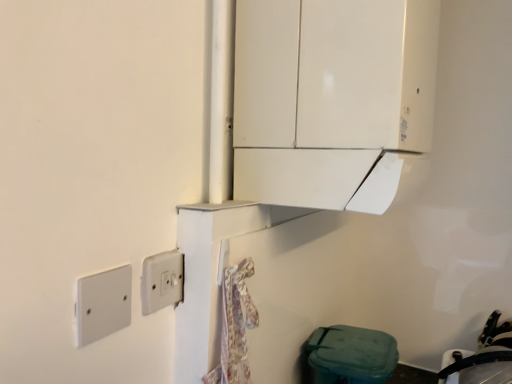
Measure the distance between point [253,64] and camera.

Point [253,64] is 29.57 inches away from camera.

This screenshot has width=512, height=384. What do you see at coordinates (162, 281) in the screenshot?
I see `white plastic light switch at center, the first light switch in the right-to-left sequence` at bounding box center [162, 281].

Find the location of a particular element. The height and width of the screenshot is (384, 512). white glossy cabinet at upper center is located at coordinates (331, 98).

In terms of height, does black rubber sink at lower right look taller or shorter compared to white plastic light switch at center, which is the 2th light switch from front to back?

Considering their sizes, black rubber sink at lower right has more height than white plastic light switch at center, which is the 2th light switch from front to back.

Is black rubber sink at lower right facing towards white plastic light switch at center, which ranks as the first light switch in back-to-front order?

No, black rubber sink at lower right does not turn towards white plastic light switch at center, which ranks as the first light switch in back-to-front order.

What's the angular difference between black rubber sink at lower right and white plastic light switch at center, which ranks as the first light switch in back-to-front order,'s facing directions?

90 degrees.

Is black rubber sink at lower right in front of white plastic light switch at center, which is the 2th light switch from front to back?

No, black rubber sink at lower right is further to the viewer.

Based on the photo, considering the positions of objects white plastic light switch at center, the first light switch in the right-to-left sequence, and white glossy cabinet at upper center in the image provided, who is more to the right, white plastic light switch at center, the first light switch in the right-to-left sequence, or white glossy cabinet at upper center?

white glossy cabinet at upper center is more to the right.

Is white plastic light switch at center, the first light switch in the right-to-left sequence, facing away from white glossy cabinet at upper center?

No, white plastic light switch at center, the first light switch in the right-to-left sequence, is not facing away from white glossy cabinet at upper center.

Identify the location of cabinetry on the right of white plastic light switch at center, the first light switch in the right-to-left sequence. (331, 98).

Is white plastic light switch at center, which ranks as the first light switch in back-to-front order, touching white glossy cabinet at upper center?

No, white plastic light switch at center, which ranks as the first light switch in back-to-front order, is not in contact with white glossy cabinet at upper center.

Could you measure the distance between white plastic light switch at center, the first light switch in the right-to-left sequence, and white plastic/light switch at lower left, positioned as the second light switch in back-to-front order?

white plastic light switch at center, the first light switch in the right-to-left sequence, is 2.85 inches away from white plastic/light switch at lower left, positioned as the second light switch in back-to-front order.

Considering the positions of objects white plastic light switch at center, which ranks as the first light switch in back-to-front order, and white plastic/light switch at lower left, which ranks as the 1th light switch in front-to-back order, in the image provided, who is behind, white plastic light switch at center, which ranks as the first light switch in back-to-front order, or white plastic/light switch at lower left, which ranks as the 1th light switch in front-to-back order,?

white plastic light switch at center, which ranks as the first light switch in back-to-front order, is further away from the camera.

From the picture: Would you say white plastic light switch at center, the first light switch in the right-to-left sequence, is inside or outside white plastic/light switch at lower left, which ranks as the 1th light switch in front-to-back order?

white plastic light switch at center, the first light switch in the right-to-left sequence, is not enclosed by white plastic/light switch at lower left, which ranks as the 1th light switch in front-to-back order.

Can you confirm if white plastic light switch at center, the first light switch in the right-to-left sequence, is positioned to the left of black rubber sink at lower right?

Indeed, white plastic light switch at center, the first light switch in the right-to-left sequence, is positioned on the left side of black rubber sink at lower right.

Considering the sizes of objects white plastic light switch at center, the first light switch in the right-to-left sequence, and black rubber sink at lower right in the image provided, who is bigger, white plastic light switch at center, the first light switch in the right-to-left sequence, or black rubber sink at lower right?

Bigger between the two is black rubber sink at lower right.

From the image's perspective, which one is positioned higher, white plastic light switch at center, which ranks as the first light switch in back-to-front order, or black rubber sink at lower right?

From the image's view, white plastic light switch at center, which ranks as the first light switch in back-to-front order, is above.

Would you say white plastic light switch at center, which is the 2th light switch from front to back, is inside or outside black rubber sink at lower right?

white plastic light switch at center, which is the 2th light switch from front to back, cannot be found inside black rubber sink at lower right.

From a real-world perspective, is black rubber sink at lower right positioned above or below white glossy cabinet at upper center?

From a real-world perspective, black rubber sink at lower right is physically below white glossy cabinet at upper center.

From the image's perspective, does black rubber sink at lower right appear lower than white glossy cabinet at upper center?

Yes, from the image's perspective, black rubber sink at lower right is beneath white glossy cabinet at upper center.

Does black rubber sink at lower right have a lesser width compared to white glossy cabinet at upper center?

Correct, the width of black rubber sink at lower right is less than that of white glossy cabinet at upper center.

Could you tell me if black rubber sink at lower right is turned towards white glossy cabinet at upper center?

No, black rubber sink at lower right is not aimed at white glossy cabinet at upper center.

Between point (345, 104) and point (118, 314), which one is positioned in front?

Point (118, 314)

Looking at this image, in terms of size, does white glossy cabinet at upper center appear bigger or smaller than white plastic/light switch at lower left, the first light switch viewed from the left?

In the image, white glossy cabinet at upper center appears to be larger than white plastic/light switch at lower left, the first light switch viewed from the left.

How distant is white glossy cabinet at upper center from white plastic/light switch at lower left, which ranks as the 1th light switch in front-to-back order?

16.16 inches.

Considering the relative positions of white glossy cabinet at upper center and white plastic/light switch at lower left, the first light switch viewed from the left, in the image provided, is white glossy cabinet at upper center to the right of white plastic/light switch at lower left, the first light switch viewed from the left, from the viewer's perspective?

Yes.

Can you tell me how much white plastic/light switch at lower left, the first light switch viewed from the left, and black rubber sink at lower right differ in facing direction?

The angular difference between white plastic/light switch at lower left, the first light switch viewed from the left, and black rubber sink at lower right is 90 degrees.

In the scene shown: Considering the relative sizes of white plastic/light switch at lower left, the first light switch viewed from the left, and black rubber sink at lower right in the image provided, is white plastic/light switch at lower left, the first light switch viewed from the left, smaller than black rubber sink at lower right?

Yes, white plastic/light switch at lower left, the first light switch viewed from the left, is smaller than black rubber sink at lower right.

Consider the image. From the image's perspective, is white plastic/light switch at lower left, the first light switch viewed from the left, above or below black rubber sink at lower right?

Clearly, from the image's perspective, white plastic/light switch at lower left, the first light switch viewed from the left, is above black rubber sink at lower right.

Is white plastic/light switch at lower left, the second light switch in the right-to-left sequence, turned away from black rubber sink at lower right?

No, black rubber sink at lower right is not at the back of white plastic/light switch at lower left, the second light switch in the right-to-left sequence.

Locate an element on the screen. Image resolution: width=512 pixels, height=384 pixels. light switch that is the 1st object located in front of the black rubber sink at lower right is located at coordinates (162, 281).

From the white glossy cabinet at upper center, count the 1st light switch to the left and point to it. Please provide its 2D coordinates.

[(162, 281)]

From the image, which object appears to be nearer to white plastic light switch at center, the first light switch in the right-to-left sequence, black rubber sink at lower right or white glossy cabinet at upper center?

white glossy cabinet at upper center is closer to white plastic light switch at center, the first light switch in the right-to-left sequence.

Estimate the real-world distances between objects in this image. Which object is further from white glossy cabinet at upper center, white plastic/light switch at lower left, the first light switch viewed from the left, or black rubber sink at lower right?

Based on the image, black rubber sink at lower right appears to be further to white glossy cabinet at upper center.

Which object lies further to the anchor point white glossy cabinet at upper center, white plastic light switch at center, which ranks as the first light switch in back-to-front order, or white plastic/light switch at lower left, which ranks as the 1th light switch in front-to-back order?

Among the two, white plastic/light switch at lower left, which ranks as the 1th light switch in front-to-back order, is located further to white glossy cabinet at upper center.

Estimate the real-world distances between objects in this image. Which object is further from white plastic/light switch at lower left, the first light switch viewed from the left, white plastic light switch at center, which is the 2th light switch from front to back, or white glossy cabinet at upper center?

white glossy cabinet at upper center is further to white plastic/light switch at lower left, the first light switch viewed from the left.

Based on their spatial positions, is black rubber sink at lower right or white plastic light switch at center, the first light switch in the right-to-left sequence, further from white glossy cabinet at upper center?

black rubber sink at lower right.

Estimate the real-world distances between objects in this image. Which object is closer to white glossy cabinet at upper center, white plastic light switch at center, which ranks as the first light switch in back-to-front order, or black rubber sink at lower right?

white plastic light switch at center, which ranks as the first light switch in back-to-front order, lies closer to white glossy cabinet at upper center than the other object.

When comparing their distances from black rubber sink at lower right, does white plastic/light switch at lower left, which ranks as the 1th light switch in front-to-back order, or white glossy cabinet at upper center seem further?

Based on the image, white plastic/light switch at lower left, which ranks as the 1th light switch in front-to-back order, appears to be further to black rubber sink at lower right.

Which object lies nearer to the anchor point white plastic light switch at center, which is the 2th light switch from front to back, white plastic/light switch at lower left, which ranks as the 1th light switch in front-to-back order, or white glossy cabinet at upper center?

white plastic/light switch at lower left, which ranks as the 1th light switch in front-to-back order, is positioned closer to the anchor white plastic light switch at center, which is the 2th light switch from front to back.

The height and width of the screenshot is (384, 512). I want to click on cabinetry situated between white plastic/light switch at lower left, the first light switch viewed from the left, and black rubber sink at lower right from left to right, so click(x=331, y=98).

You are a GUI agent. You are given a task and a screenshot of the screen. Output one action in this format:
    pyautogui.click(x=<x>, y=<y>)
    Task: Click on the light switch located between white plastic/light switch at lower left, the first light switch viewed from the left, and black rubber sink at lower right in the left-right direction
    This screenshot has width=512, height=384.
    Given the screenshot: What is the action you would take?
    pyautogui.click(x=162, y=281)

Image resolution: width=512 pixels, height=384 pixels. In order to click on light switch between white plastic/light switch at lower left, the first light switch viewed from the left, and white glossy cabinet at upper center from left to right in this screenshot , I will do `click(162, 281)`.